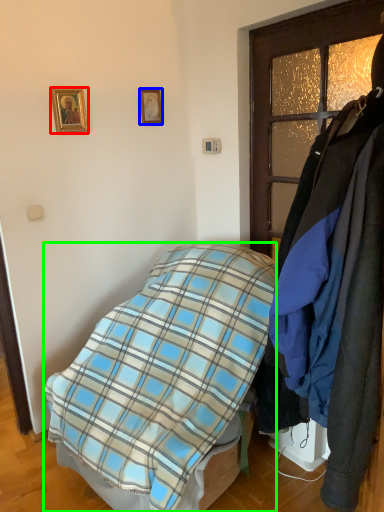
Question: Considering the real-world distances, which object is farthest from picture frame (highlighted by a red box)? picture frame (highlighted by a blue box) or bed (highlighted by a green box)?

Choices:
 (A) picture frame
 (B) bed

Answer: (B)